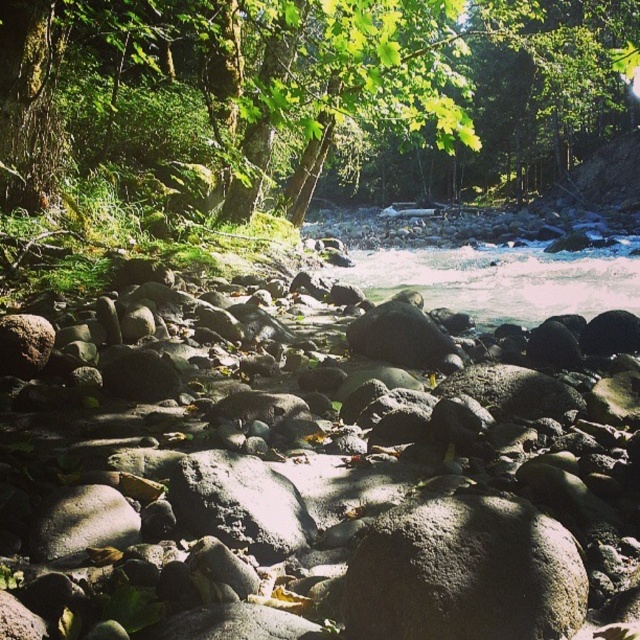
You are standing at the edge of the river and see the gray smooth rocks at center represented by point (321, 486). Can you walk directly to that point without stepping on any rocks?

The gray smooth rocks at center represented by point (321, 486) are located in the middle of the river, so you would need to step on them to reach that point.

You are planning to cross the river using the gray smooth rocks at center and the green mossy tree at upper center. Which one is wider so you can step on it safely?

The green mossy tree at upper center is wider than the gray smooth rocks at center, so it is safer to step on the green mossy tree at upper center.